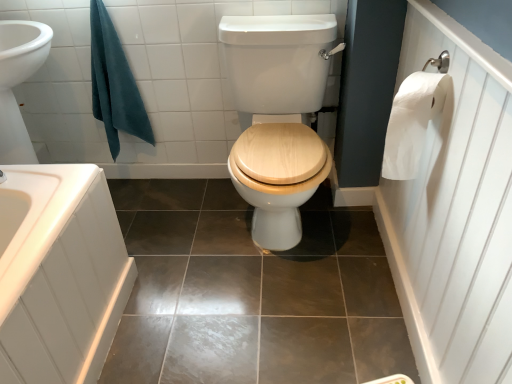
Identify the location of unoccupied area in front of white wood toilet seat at center. The height and width of the screenshot is (384, 512). (273, 321).